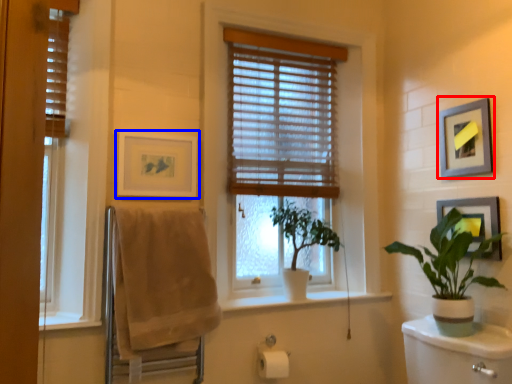
Question: Which object is closer to the camera taking this photo, picture frame (highlighted by a red box) or picture frame (highlighted by a blue box)?

Choices:
 (A) picture frame
 (B) picture frame

Answer: (A)